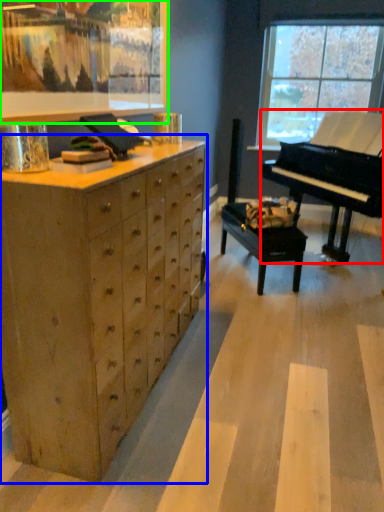
Question: Considering the real-world distances, which object is closest to piano (highlighted by a red box)? chest of drawers (highlighted by a blue box) or picture frame (highlighted by a green box).

Choices:
 (A) chest of drawers
 (B) picture frame

Answer: (B)